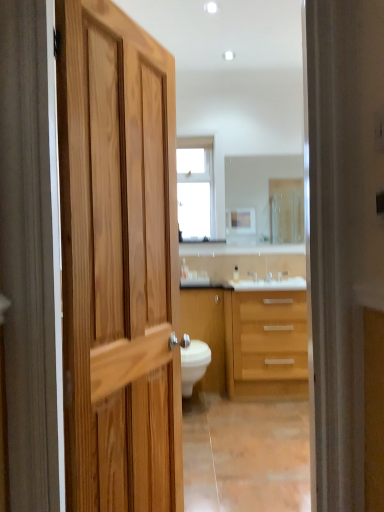
Question: From a real-world perspective, does clear glass mirror at center sit lower than clear glass window at upper center?

Choices:
 (A) no
 (B) yes

Answer: (B)

Question: Is clear glass mirror at center behind clear glass window at upper center?

Choices:
 (A) no
 (B) yes

Answer: (B)

Question: Is clear glass mirror at center wider than clear glass window at upper center?

Choices:
 (A) no
 (B) yes

Answer: (A)

Question: Considering the relative sizes of clear glass mirror at center and clear glass window at upper center in the image provided, is clear glass mirror at center shorter than clear glass window at upper center?

Choices:
 (A) no
 (B) yes

Answer: (B)

Question: From the image's perspective, is clear glass mirror at center below clear glass window at upper center?

Choices:
 (A) yes
 (B) no

Answer: (A)

Question: Is clear glass mirror at center positioned far away from clear glass window at upper center?

Choices:
 (A) no
 (B) yes

Answer: (A)

Question: Does matte wood cabinet at center come in front of light wood cabinet at center?

Choices:
 (A) no
 (B) yes

Answer: (A)

Question: Is there a large distance between matte wood cabinet at center and light wood cabinet at center?

Choices:
 (A) no
 (B) yes

Answer: (A)

Question: Considering the relative sizes of matte wood cabinet at center and light wood cabinet at center in the image provided, is matte wood cabinet at center taller than light wood cabinet at center?

Choices:
 (A) no
 (B) yes

Answer: (B)

Question: Is matte wood cabinet at center positioned behind light wood cabinet at center?

Choices:
 (A) yes
 (B) no

Answer: (A)

Question: Is light wood cabinet at center located within matte wood cabinet at center?

Choices:
 (A) yes
 (B) no

Answer: (B)

Question: From the image's perspective, is matte wood cabinet at center under light wood cabinet at center?

Choices:
 (A) yes
 (B) no

Answer: (A)

Question: Would you consider matte wood cabinet at center to be distant from clear glass mirror at center?

Choices:
 (A) yes
 (B) no

Answer: (B)